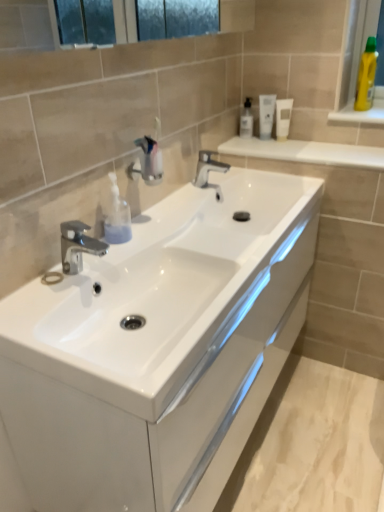
The height and width of the screenshot is (512, 384). In order to click on unoccupied space behind polished chrome tap at left, the first tap in the bottom-to-top sequence in this screenshot , I will do `click(113, 254)`.